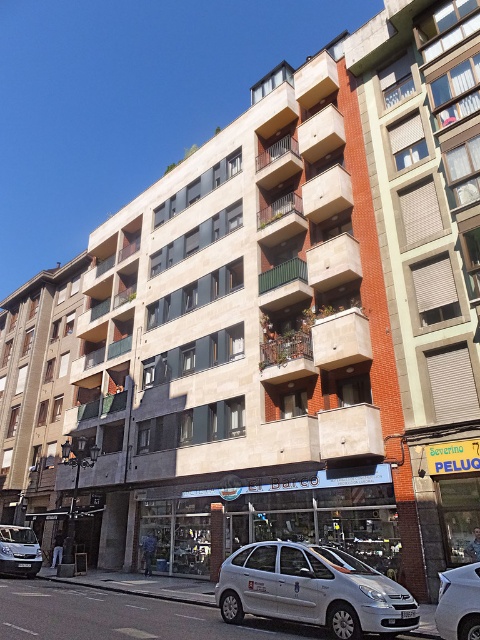
Can you confirm if white matte car at lower center is positioned above silver metallic van at lower left?

Yes.

Is point (415, 621) closer to camera compared to point (31, 568)?

That is True.

Image resolution: width=480 pixels, height=640 pixels. Identify the location of white matte car at lower center. pyautogui.click(x=312, y=589).

I want to click on white matte car at lower center, so click(312, 589).

Does silver metallic car at center have a larger size compared to silver metallic van at lower left?

Yes, silver metallic car at center is bigger than silver metallic van at lower left.

The image size is (480, 640). What are the coordinates of `silver metallic car at center` in the screenshot? It's located at (458, 602).

Locate an element on the screen. silver metallic car at center is located at coordinates (458, 602).

Between white matte car at lower center and silver metallic car at center, which one appears on the right side from the viewer's perspective?

From the viewer's perspective, silver metallic car at center appears more on the right side.

Is white matte car at lower center thinner than silver metallic car at center?

Incorrect, white matte car at lower center's width is not less than silver metallic car at center's.

Describe the element at coordinates (312, 589) in the screenshot. This screenshot has height=640, width=480. I see `white matte car at lower center` at that location.

Locate an element on the screen. The image size is (480, 640). white matte car at lower center is located at coordinates pyautogui.click(x=312, y=589).